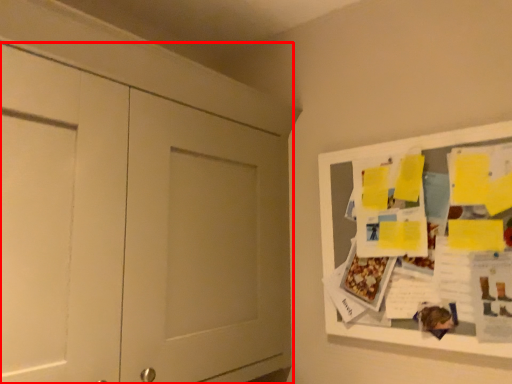
Question: From the image's perspective, what is the correct spatial positioning of door (annotated by the red box) in reference to bulletin board?

Choices:
 (A) below
 (B) above

Answer: (B)